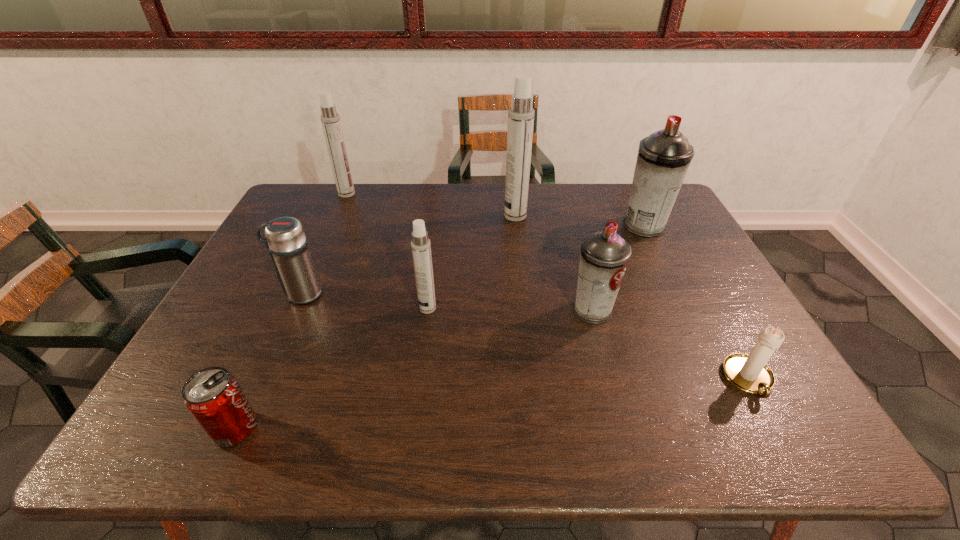
The width and height of the screenshot is (960, 540). Identify the location of free area in between the red pop soda and the right gray aerosol can. (440, 327).

Where is `vacant area that lies between the farther gray aerosol can and the farthest object`? The width and height of the screenshot is (960, 540). vacant area that lies between the farther gray aerosol can and the farthest object is located at coordinates (495, 210).

Where is `vacant region between the left gray aerosol can and the red pop soda`? The height and width of the screenshot is (540, 960). vacant region between the left gray aerosol can and the red pop soda is located at coordinates (414, 369).

Identify the location of vacant area between the nearest object and the thermos bottle. Image resolution: width=960 pixels, height=540 pixels. (268, 361).

You are a GUI agent. You are given a task and a screenshot of the screen. Output one action in this format:
    pyautogui.click(x=<x>, y=<y>)
    Task: Click on the free space between the rightmost white aerosol can and the leftmost aerosol can
    
    Given the screenshot: What is the action you would take?
    pyautogui.click(x=431, y=205)

This screenshot has width=960, height=540. I want to click on the fourth closest object to the third shortest object, so click(521, 114).

You are a GUI agent. You are given a task and a screenshot of the screen. Output one action in this format:
    pyautogui.click(x=<x>, y=<y>)
    Task: Click on the object that is the fifth closest to the smallest white aerosol can
    The image size is (960, 540).
    Given the screenshot: What is the action you would take?
    pyautogui.click(x=330, y=119)

Select which aerosol can is the fourth closest to the right gray aerosol can. Please provide its 2D coordinates. Your answer should be formatted as a tuple, i.e. [(x, y)], where the tuple contains the x and y coordinates of a point satisfying the conditions above.

[(330, 119)]

The width and height of the screenshot is (960, 540). I want to click on aerosol can that is the second nearest to the bigger gray aerosol can, so click(521, 114).

Choose which white aerosol can is the nearest neighbor to the fourth object from right to left. Please provide its 2D coordinates. Your answer should be formatted as a tuple, i.e. [(x, y)], where the tuple contains the x and y coordinates of a point satisfying the conditions above.

[(421, 247)]